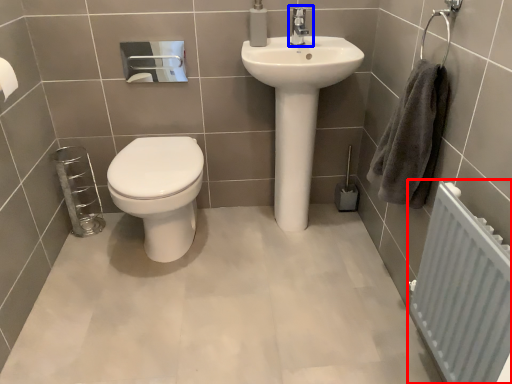
Question: Which object is further to the camera taking this photo, radiator (highlighted by a red box) or tap (highlighted by a blue box)?

Choices:
 (A) radiator
 (B) tap

Answer: (B)